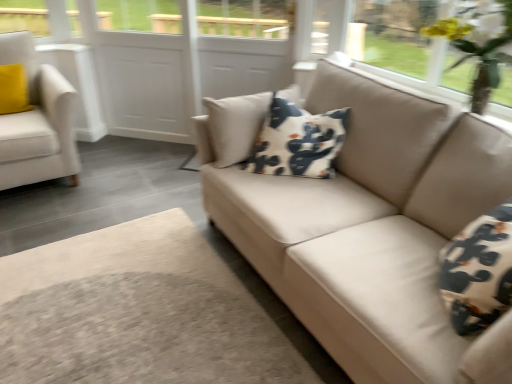
In order to face white fabric armchair at left, should I rotate leftwards or rightwards?

It's best to rotate left around 28.495 degrees.

What are the coordinates of `beige fabric couch at center` in the screenshot? It's located at (366, 224).

Describe the element at coordinates (366, 224) in the screenshot. The width and height of the screenshot is (512, 384). I see `beige fabric couch at center` at that location.

What is the approximate width of white matte screen door at center?

white matte screen door at center is 3.79 inches in width.

Locate an element on the screen. This screenshot has width=512, height=384. white fabric armchair at left is located at coordinates tap(37, 122).

Considering the relative sizes of beige fabric couch at center and yellow artificial flowers at upper right in the image provided, is beige fabric couch at center bigger than yellow artificial flowers at upper right?

Correct, beige fabric couch at center is larger in size than yellow artificial flowers at upper right.

Is beige fabric couch at center taller or shorter than yellow artificial flowers at upper right?

Clearly, beige fabric couch at center is shorter compared to yellow artificial flowers at upper right.

From a real-world perspective, which object rests below the other?

beige fabric couch at center is physically lower.

Is white fabric armchair at left far away from yellow artificial flowers at upper right?

Absolutely, white fabric armchair at left is distant from yellow artificial flowers at upper right.

Which of these two, white fabric armchair at left or yellow artificial flowers at upper right, is wider?

white fabric armchair at left is wider.

Looking at this image, is white fabric armchair at left in front of or behind yellow artificial flowers at upper right in the image?

white fabric armchair at left is behind yellow artificial flowers at upper right.

Which object is closer to the camera, white cotton pillow at center or white matte screen door at center?

white cotton pillow at center is more forward.

Could you tell me if white cotton pillow at center is turned towards white matte screen door at center?

No, white cotton pillow at center is not turned towards white matte screen door at center.

Is point (287, 168) positioned behind point (140, 118)?

No.

How many degrees apart are the facing directions of white cotton pillow at center and white matte screen door at center?

The facing directions of white cotton pillow at center and white matte screen door at center are 10.9 degrees apart.

Looking at this image, how much distance is there between white fabric armchair at left and beige fabric couch at center?

white fabric armchair at left is 5.77 feet from beige fabric couch at center.

Can you confirm if white fabric armchair at left is positioned to the right of beige fabric couch at center?

Incorrect, white fabric armchair at left is not on the right side of beige fabric couch at center.

Is white fabric armchair at left placed right next to beige fabric couch at center?

white fabric armchair at left and beige fabric couch at center are not in contact.

Can you confirm if white fabric armchair at left is smaller than beige fabric couch at center?

Yes.

The height and width of the screenshot is (384, 512). In order to click on floral arrangement above the beige fabric couch at center (from the image's perspective) in this screenshot , I will do `click(478, 43)`.

Between yellow artificial flowers at upper right and beige fabric couch at center, which one has smaller width?

Thinner between the two is yellow artificial flowers at upper right.

How many degrees apart are the facing directions of yellow artificial flowers at upper right and beige fabric couch at center?

0.161 degrees separate the facing orientations of yellow artificial flowers at upper right and beige fabric couch at center.

How far apart are yellow artificial flowers at upper right and beige fabric couch at center?

yellow artificial flowers at upper right is 29.18 inches away from beige fabric couch at center.

From the image's perspective, which is above, beige fabric couch at center or white fabric armchair at left?

white fabric armchair at left is shown above in the image.

Is beige fabric couch at center bigger than white fabric armchair at left?

Yes, beige fabric couch at center is bigger than white fabric armchair at left.

Considering the points (309, 260) and (19, 127), which point is in front, point (309, 260) or point (19, 127)?

Point (309, 260)

Identify the location of floral arrangement located above the white cotton pillow at center (from a real-world perspective). (478, 43).

Would you say yellow artificial flowers at upper right contains white cotton pillow at center?

No, white cotton pillow at center is not a part of yellow artificial flowers at upper right.

Visually, is yellow artificial flowers at upper right positioned to the left or to the right of white cotton pillow at center?

yellow artificial flowers at upper right is positioned on white cotton pillow at center's right side.

Which object is closer to the camera, yellow artificial flowers at upper right or white cotton pillow at center?

yellow artificial flowers at upper right.

In order to click on floral arrangement above the beige fabric couch at center (from a real-world perspective) in this screenshot , I will do `click(478, 43)`.

You are a GUI agent. You are given a task and a screenshot of the screen. Output one action in this format:
    pyautogui.click(x=<x>, y=<y>)
    Task: Click on the floral arrangement located above the white fabric armchair at left (from the image's perspective)
    
    Given the screenshot: What is the action you would take?
    pyautogui.click(x=478, y=43)

When comparing their distances from white matte screen door at center, does beige fabric couch at center or white fabric armchair at left seem closer?

white fabric armchair at left lies closer to white matte screen door at center than the other object.

When comparing their distances from white matte screen door at center, does yellow artificial flowers at upper right or white cotton pillow at center seem closer?

Based on the image, white cotton pillow at center appears to be nearer to white matte screen door at center.

Estimate the real-world distances between objects in this image. Which object is further from beige fabric couch at center, white matte screen door at center or white cotton pillow at center?

white matte screen door at center is positioned further to the anchor beige fabric couch at center.

From the image, which object appears to be farther from white fabric armchair at left, white cotton pillow at center or white matte screen door at center?

Based on the image, white cotton pillow at center appears to be further to white fabric armchair at left.

Looking at the image, which one is located further to white cotton pillow at center, white matte screen door at center or beige fabric couch at center?

white matte screen door at center.

In the scene shown: Considering their positions, is white cotton pillow at center positioned further to white fabric armchair at left than yellow artificial flowers at upper right?

yellow artificial flowers at upper right is positioned further to the anchor white fabric armchair at left.

Looking at the image, which one is located further to white matte screen door at center, white cotton pillow at center or yellow artificial flowers at upper right?

Based on the image, yellow artificial flowers at upper right appears to be further to white matte screen door at center.

When comparing their distances from yellow artificial flowers at upper right, does beige fabric couch at center or white matte screen door at center seem closer?

Based on the image, beige fabric couch at center appears to be nearer to yellow artificial flowers at upper right.

Locate an element on the screen. The height and width of the screenshot is (384, 512). studio couch between white fabric armchair at left and white cotton pillow at center is located at coordinates (366, 224).

This screenshot has width=512, height=384. What are the coordinates of `pillow situated between white fabric armchair at left and yellow artificial flowers at upper right from left to right` in the screenshot? It's located at (298, 141).

Locate an element on the screen. This screenshot has width=512, height=384. chair located between beige fabric couch at center and white matte screen door at center in the depth direction is located at coordinates (37, 122).

Find the location of a particular element. Image resolution: width=512 pixels, height=384 pixels. screen door between white fabric armchair at left and yellow artificial flowers at upper right is located at coordinates (145, 69).